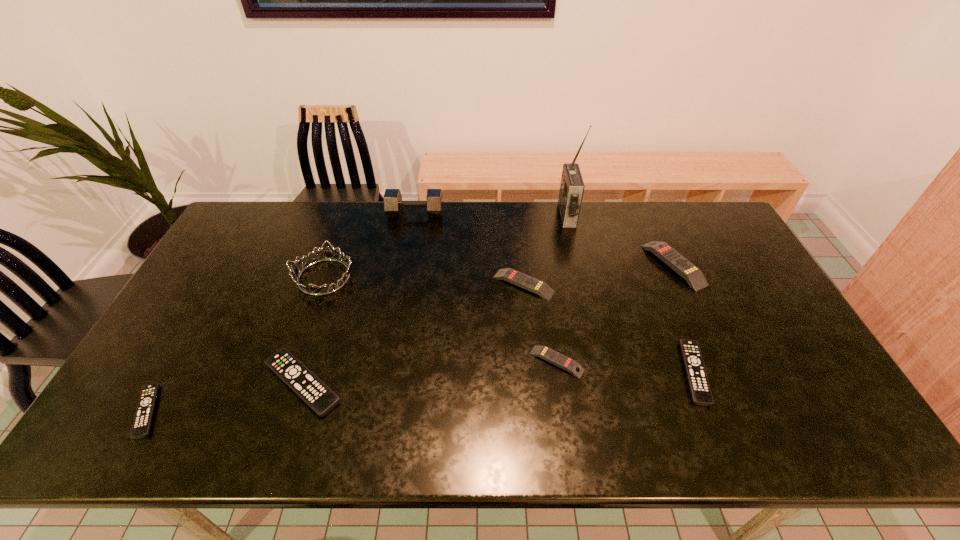
Where is `black remote control that stands as the third closest to the second smallest yellow remote control`? black remote control that stands as the third closest to the second smallest yellow remote control is located at coordinates (143, 417).

Identify the location of the third closest black remote control relative to the nearest yellow remote control. The image size is (960, 540). (143, 417).

Where is `vacant space that satisfies the following two spatial constraints: 1. on the back side of the biggest black remote control; 2. on the left side of the second biggest yellow remote control`? The image size is (960, 540). vacant space that satisfies the following two spatial constraints: 1. on the back side of the biggest black remote control; 2. on the left side of the second biggest yellow remote control is located at coordinates (335, 285).

Locate an element on the screen. Image resolution: width=960 pixels, height=540 pixels. vacant space that satisfies the following two spatial constraints: 1. on the display of the tallest object; 2. on the front-facing side of the third tallest object is located at coordinates (582, 277).

Image resolution: width=960 pixels, height=540 pixels. Find the location of `blank area in the image that satisfies the following two spatial constraints: 1. on the front-facing side of the smallest yellow remote control; 2. on the right side of the tiara`. blank area in the image that satisfies the following two spatial constraints: 1. on the front-facing side of the smallest yellow remote control; 2. on the right side of the tiara is located at coordinates (295, 361).

The image size is (960, 540). I want to click on free spot that satisfies the following two spatial constraints: 1. on the display of the tallest object; 2. on the front-facing side of the tiara, so click(x=582, y=277).